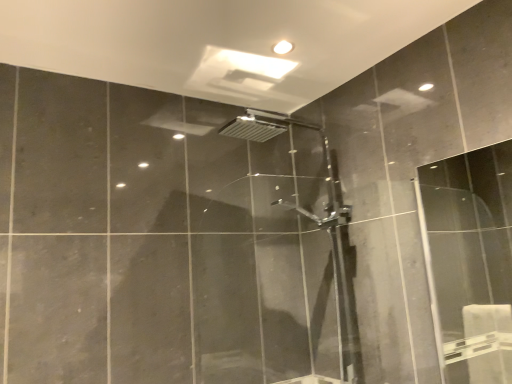
Question: Should I look upward or downward to see transparent glass screen door at right?

Choices:
 (A) up
 (B) down

Answer: (B)

Question: Is polished chrome shower door at center looking in the opposite direction of transparent glass screen door at right?

Choices:
 (A) no
 (B) yes

Answer: (A)

Question: Is polished chrome shower door at center oriented towards transparent glass screen door at right?

Choices:
 (A) no
 (B) yes

Answer: (A)

Question: Are polished chrome shower door at center and transparent glass screen door at right located far from each other?

Choices:
 (A) yes
 (B) no

Answer: (A)

Question: Is polished chrome shower door at center to the right of transparent glass screen door at right from the viewer's perspective?

Choices:
 (A) yes
 (B) no

Answer: (B)

Question: From the image's perspective, is polished chrome shower door at center under transparent glass screen door at right?

Choices:
 (A) no
 (B) yes

Answer: (B)

Question: Does polished chrome shower door at center have a greater height compared to transparent glass screen door at right?

Choices:
 (A) yes
 (B) no

Answer: (A)

Question: Considering the relative sizes of transparent glass screen door at right and polished chrome shower door at center in the image provided, is transparent glass screen door at right shorter than polished chrome shower door at center?

Choices:
 (A) no
 (B) yes

Answer: (B)

Question: Can you confirm if transparent glass screen door at right is smaller than polished chrome shower door at center?

Choices:
 (A) no
 (B) yes

Answer: (B)

Question: Is transparent glass screen door at right positioned with its back to polished chrome shower door at center?

Choices:
 (A) yes
 (B) no

Answer: (B)

Question: Could polished chrome shower door at center be considered to be inside transparent glass screen door at right?

Choices:
 (A) no
 (B) yes

Answer: (A)

Question: Considering the relative positions of transparent glass screen door at right and polished chrome shower door at center in the image provided, is transparent glass screen door at right to the left of polished chrome shower door at center from the viewer's perspective?

Choices:
 (A) yes
 (B) no

Answer: (B)

Question: Is transparent glass screen door at right wider than polished chrome shower door at center?

Choices:
 (A) yes
 (B) no

Answer: (B)

Question: Is polished chrome shower door at center taller or shorter than transparent glass screen door at right?

Choices:
 (A) short
 (B) tall

Answer: (B)